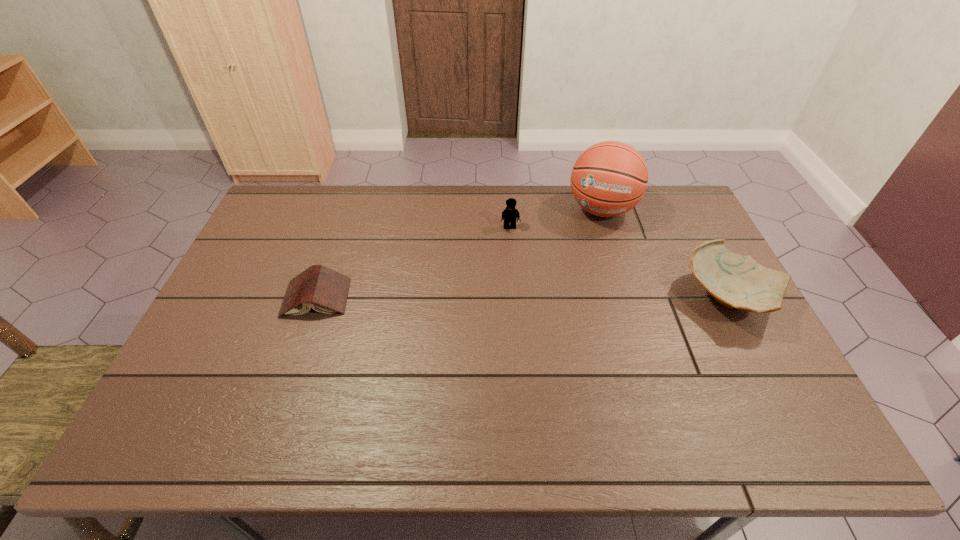
This screenshot has width=960, height=540. I want to click on vacant space at the right edge, so click(677, 271).

Locate an element on the screen. This screenshot has height=540, width=960. free region at the near left corner of the desktop is located at coordinates pyautogui.click(x=192, y=380).

Identify the location of vacant space at the far right corner. This screenshot has height=540, width=960. (667, 211).

Image resolution: width=960 pixels, height=540 pixels. In order to click on empty space that is in between the tallest object and the rightmost object in this screenshot , I will do `click(665, 253)`.

In order to click on vacant area that lies between the second object from left to right and the second object from right to left in this screenshot , I will do `click(556, 219)`.

Where is `free point between the leftmost object and the second object from left to right`? The image size is (960, 540). free point between the leftmost object and the second object from left to right is located at coordinates (413, 262).

The width and height of the screenshot is (960, 540). I want to click on unoccupied position between the third object from left to right and the Lego, so click(556, 219).

Identify the location of free spot between the shortest object and the third object from right to left. Image resolution: width=960 pixels, height=540 pixels. (413, 262).

You are a GUI agent. You are given a task and a screenshot of the screen. Output one action in this format:
    pyautogui.click(x=<x>, y=<y>)
    Task: Click on the free space between the rightmost object and the second object from right to left
    This screenshot has height=540, width=960.
    Given the screenshot: What is the action you would take?
    pyautogui.click(x=665, y=253)

At what (x,y) coordinates should I click in order to perform the action: click on vacant space that is in between the pottery and the third object from left to right. Please return your answer as a coordinate pair (x, y). The height and width of the screenshot is (540, 960). Looking at the image, I should click on (665, 253).